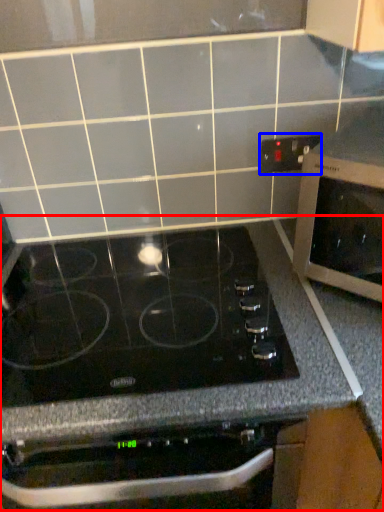
Question: Which point is further to the camera, counter (highlighted by a red box) or electric outlet (highlighted by a blue box)?

Choices:
 (A) counter
 (B) electric outlet

Answer: (B)